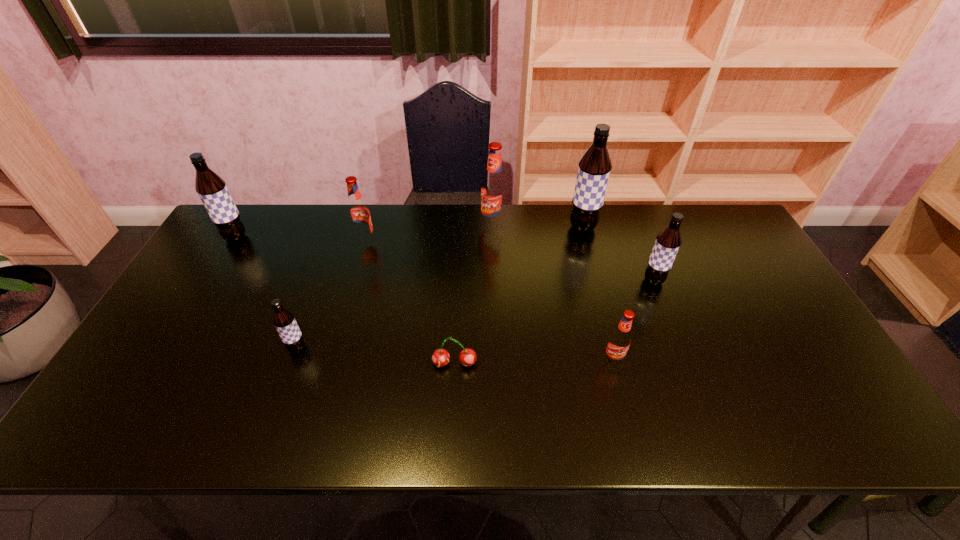
This screenshot has height=540, width=960. I want to click on the tallest root beer, so coord(594,169).

Where is `the second brown root beer from right to left`? the second brown root beer from right to left is located at coordinates (594, 169).

Locate an element on the screen. This screenshot has height=540, width=960. the leftmost brown root beer is located at coordinates (211, 188).

At what (x,y) coordinates should I click in order to perform the action: click on the leftmost root beer. Please return your answer as a coordinate pair (x, y). Looking at the image, I should click on (211, 188).

The height and width of the screenshot is (540, 960). Identify the location of the second red root beer from right to left. (494, 187).

The height and width of the screenshot is (540, 960). I want to click on the biggest red root beer, so click(494, 187).

Where is `the third object from left to right`? The height and width of the screenshot is (540, 960). the third object from left to right is located at coordinates tap(358, 212).

Where is `the third root beer from left to right`? The width and height of the screenshot is (960, 540). the third root beer from left to right is located at coordinates (358, 212).

Find the location of `the rightmost object`. the rightmost object is located at coordinates (668, 241).

I want to click on the fifth farthest root beer, so click(668, 241).